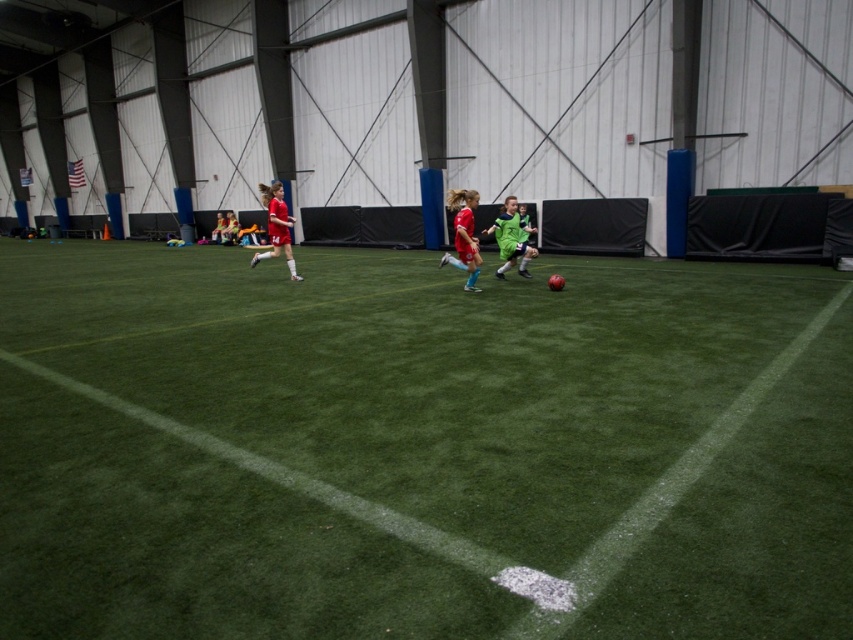
You are a referee observing the soccer game. You notice two players at the center of the field. Which player is positioned lower in the image, the red jersey at center or the green matte soccer player at center?

The red jersey at center is positioned below the green matte soccer player at center, so the red jersey at center is lower in the image.

You are a photographer standing at the edge of the soccer field. You want to take a photo that includes both the green artificial turf at center and the green matte soccer player at center. Which object will appear larger in the photo?

The green artificial turf at center will appear larger in the photo because it is closer to the viewer than the green matte soccer player at center.